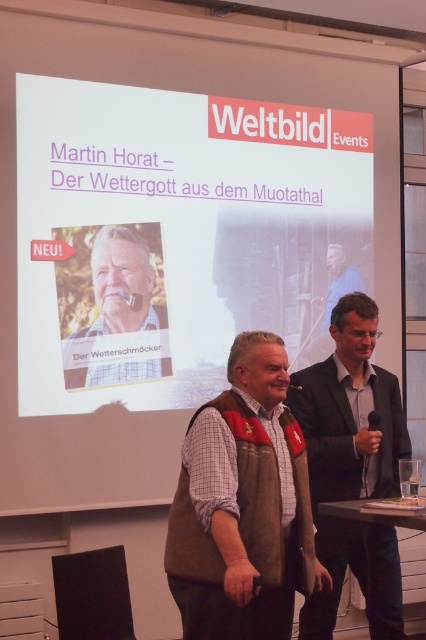
You are attending a presentation and notice two vests worn by the speakers. The leather vest at center and the matte brown vest at center. Which vest is located to the right of the other?

The leather vest at center is positioned on the right side of the matte brown vest at center.

You are an event organizer preparing for a presentation. You need to ensure that the two presenters can move comfortably between their respective positions. The leather vest at center is worn by the presenter on the left, and the matte black jacket at right is worn by the presenter on the right. Given that the space between them is 2 meters, will they have enough room to move without bumping into each other?

The leather vest at center is wider than the matte black jacket at right. Since the space between them is 2 meters, they should have sufficient room to move comfortably without colliding.